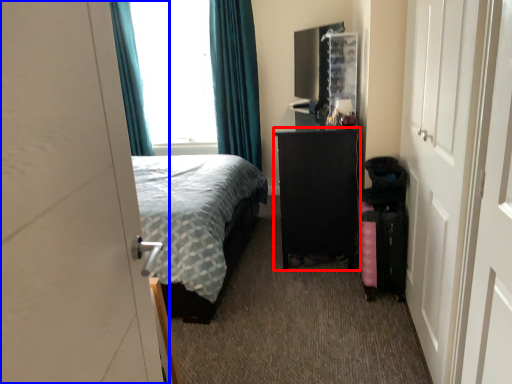
Question: Which object appears farthest to the camera in this image, furniture (highlighted by a red box) or door (highlighted by a blue box)?

Choices:
 (A) furniture
 (B) door

Answer: (A)